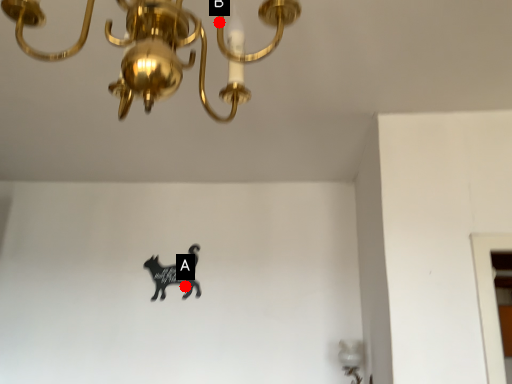
Question: Two points are circled on the image, labeled by A and B beside each circle. Among these points, which one is farthest from the camera?

Choices:
 (A) A is further
 (B) B is further

Answer: (A)